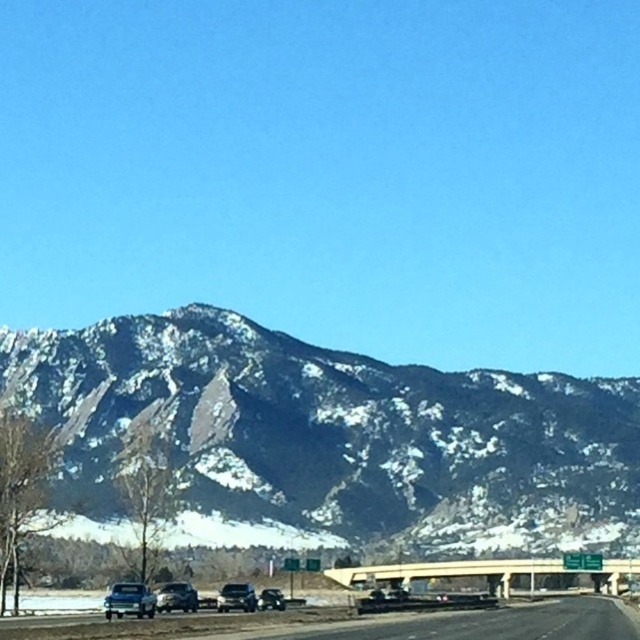
Between point (401, 624) and point (148, 596), which one is positioned behind?

The point (401, 624) is behind.

Is point (326, 618) positioned after point (125, 608)?

That is True.

Where is `asphalt road at lower center`? asphalt road at lower center is located at coordinates (369, 625).

Is asphalt road at lower center to the left of shiny silver sedan at center from the viewer's perspective?

Incorrect, asphalt road at lower center is not on the left side of shiny silver sedan at center.

Does asphalt road at lower center have a greater height compared to shiny silver sedan at center?

Correct, asphalt road at lower center is much taller as shiny silver sedan at center.

Is point (307, 625) positioned before point (173, 582)?

That is True.

Find the location of a particular element. The width and height of the screenshot is (640, 640). asphalt road at lower center is located at coordinates (369, 625).

Does asphalt road at lower center appear over concrete bridge at center?

Yes, asphalt road at lower center is above concrete bridge at center.

Image resolution: width=640 pixels, height=640 pixels. What are the coordinates of `asphalt road at lower center` in the screenshot? It's located at (369, 625).